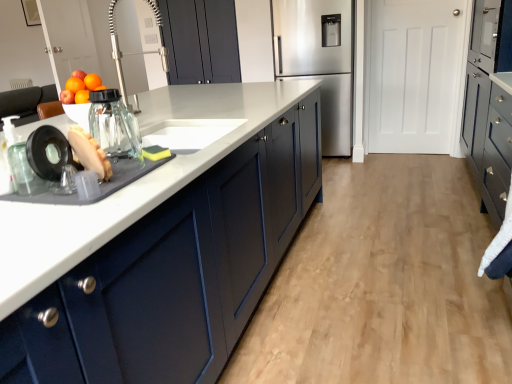
Identify the location of vacant region to the left of yellow sponge at sink, the 2th food viewed from the front. (125, 155).